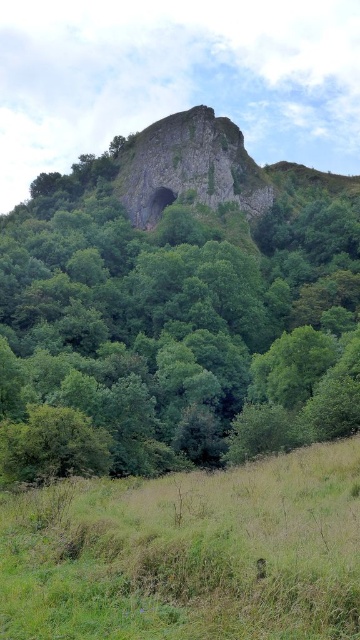
Is green leafy tree at center to the left of green grassy field at lower center from the viewer's perspective?

Yes, green leafy tree at center is to the left of green grassy field at lower center.

Can you confirm if green leafy tree at center is positioned below green grassy field at lower center?

No, green leafy tree at center is not below green grassy field at lower center.

Between point (230, 355) and point (108, 499), which one is positioned in front?

Positioned in front is point (108, 499).

Locate an element on the screen. green leafy tree at center is located at coordinates (183, 317).

Is green leafy tree at center below rusty stone rock at center?

Yes.

Can you confirm if green leafy tree at center is positioned to the right of rusty stone rock at center?

No, green leafy tree at center is not to the right of rusty stone rock at center.

Does point (15, 317) lie in front of point (212, 144)?

Yes, point (15, 317) is in front of point (212, 144).

Find the location of a particular element. green leafy tree at center is located at coordinates (183, 317).

Who is positioned more to the right, green grassy field at lower center or rusty stone rock at center?

green grassy field at lower center is more to the right.

Does green grassy field at lower center have a lesser height compared to rusty stone rock at center?

Yes, green grassy field at lower center is shorter than rusty stone rock at center.

Identify the location of green grassy field at lower center. (189, 554).